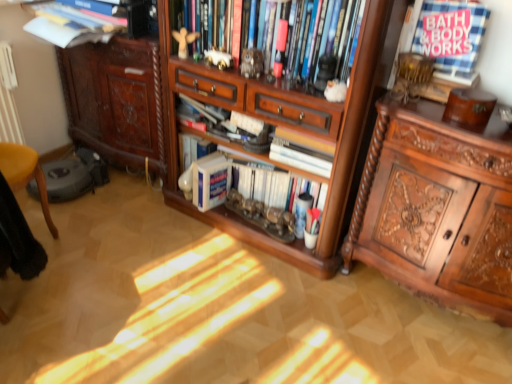
Question: Is white paper at center, which is counted as the third book, starting from the bottom, to the left or to the right of wooden cabinet at center in the image?

Choices:
 (A) left
 (B) right

Answer: (B)

Question: Do you think white paper at center, which is counted as the third book, starting from the bottom, is within wooden cabinet at center, or outside of it?

Choices:
 (A) outside
 (B) inside

Answer: (B)

Question: Considering the real-world distances, which object is farthest from the white paper at center, which is the third book in top-to-bottom order?

Choices:
 (A) white fluffy toy at upper center, arranged as the first toy when viewed from the right
 (B) white porcelain elephant at upper center, the second toy positioned from the left
 (C) metallic statue at center, marked as the 3th toy in a back-to-front arrangement
 (D) polished wood cabinet at right, the 1th cabinetry positioned from the right
 (E) brown carved cabinet at left, acting as the second cabinetry starting from the right

Answer: (E)

Question: Estimate the real-world distances between objects in this image. Which object is closer to the brown carved cabinet at left, arranged as the first cabinetry when viewed from the left?

Choices:
 (A) white fluffy toy at upper center, arranged as the fourth toy when viewed from the back
 (B) polished wood cabinet at right, the second cabinetry positioned from the left
 (C) hardcover book at center, which is the second book in bottom-to-top order
 (D) wooden cabinet at center
 (E) metallic statue at center, marked as the 3th toy in a back-to-front arrangement

Answer: (D)